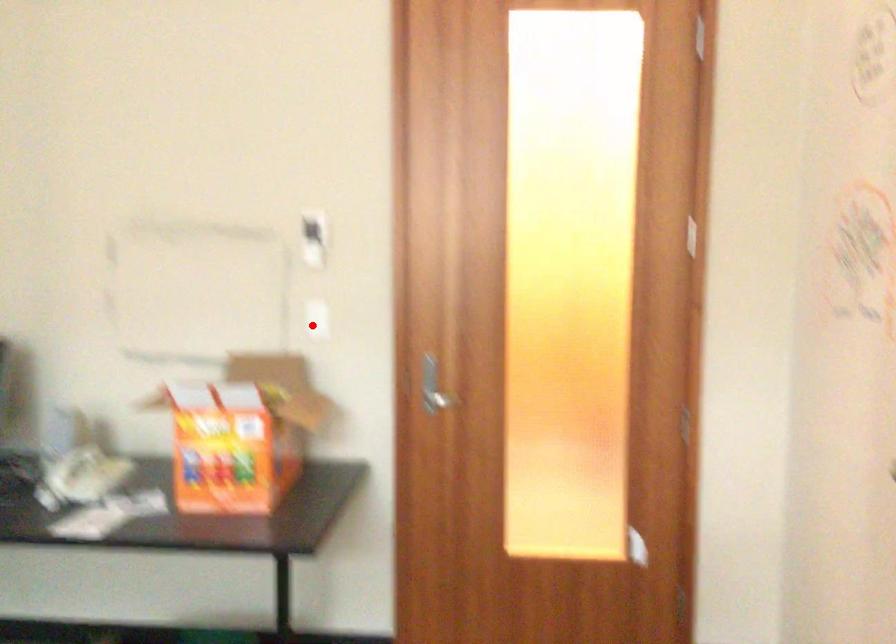
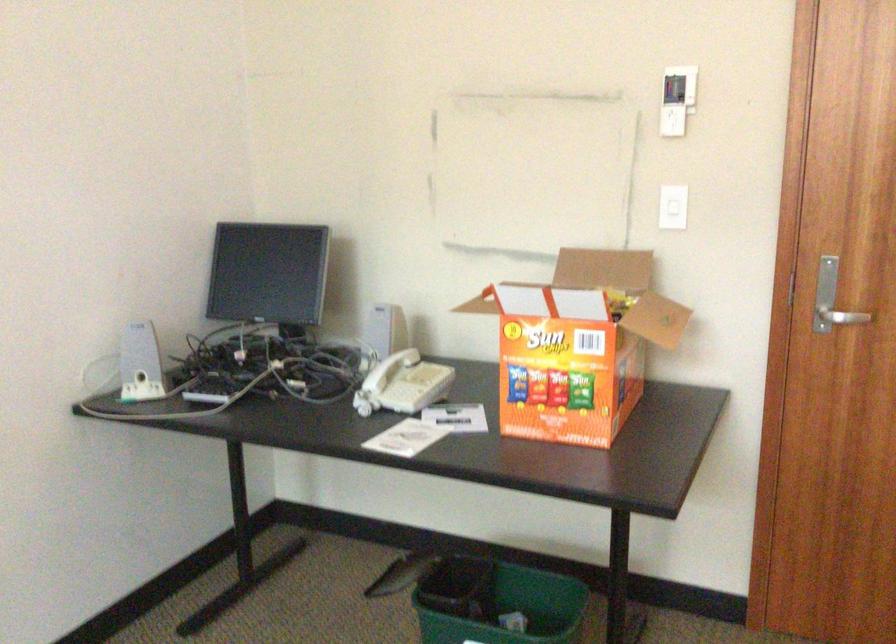
Question: I am providing you with two images of the same scene from different viewpoints. Image1 has a red point marked. In image2, the corresponding 3D location appears at what relative position? Reply with the corresponding letter.

Choices:
 (A) Closer
 (B) Farther

Answer: (A)